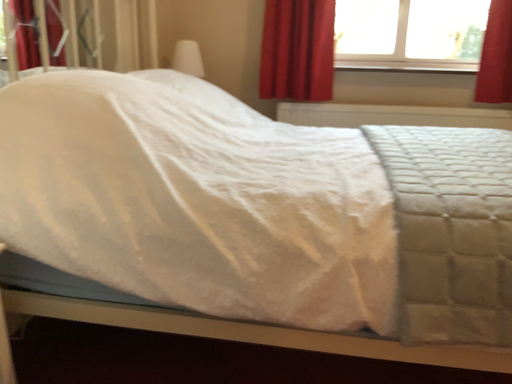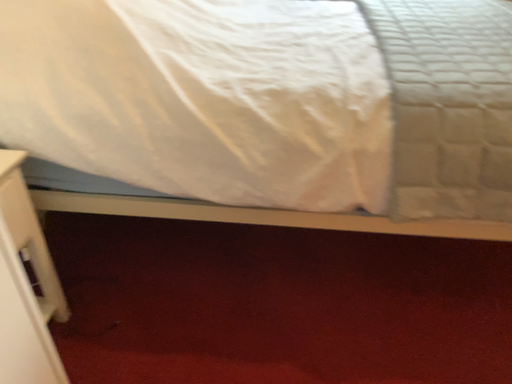
Question: How did the camera likely rotate when shooting the video?

Choices:
 (A) rotated downward
 (B) rotated upward

Answer: (A)